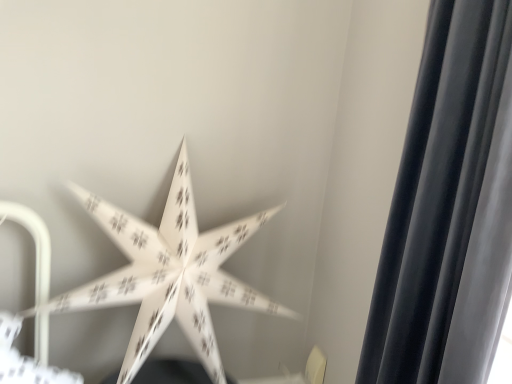
Question: From a real-world perspective, is silky black curtain at right positioned over white paper star at center based on gravity?

Choices:
 (A) yes
 (B) no

Answer: (A)

Question: Is silky black curtain at right far away from white paper star at center?

Choices:
 (A) no
 (B) yes

Answer: (A)

Question: From a real-world perspective, is silky black curtain at right located beneath white paper star at center?

Choices:
 (A) yes
 (B) no

Answer: (B)

Question: Does silky black curtain at right have a greater height compared to white paper star at center?

Choices:
 (A) no
 (B) yes

Answer: (B)

Question: From the image's perspective, is silky black curtain at right located beneath white paper star at center?

Choices:
 (A) yes
 (B) no

Answer: (B)

Question: Does silky black curtain at right have a lesser width compared to white paper star at center?

Choices:
 (A) no
 (B) yes

Answer: (B)

Question: Is white paper star at center turned away from silky black curtain at right?

Choices:
 (A) yes
 (B) no

Answer: (B)

Question: Could you tell me if white paper star at center is turned towards silky black curtain at right?

Choices:
 (A) no
 (B) yes

Answer: (B)

Question: From a real-world perspective, is white paper star at center over silky black curtain at right?

Choices:
 (A) no
 (B) yes

Answer: (A)

Question: Is white paper star at center in contact with silky black curtain at right?

Choices:
 (A) no
 (B) yes

Answer: (A)

Question: From the image's perspective, is white paper star at center above silky black curtain at right?

Choices:
 (A) no
 (B) yes

Answer: (A)

Question: Is the position of white paper star at center less distant than that of silky black curtain at right?

Choices:
 (A) no
 (B) yes

Answer: (A)

Question: Is white paper star at center spatially inside silky black curtain at right, or outside of it?

Choices:
 (A) outside
 (B) inside

Answer: (A)